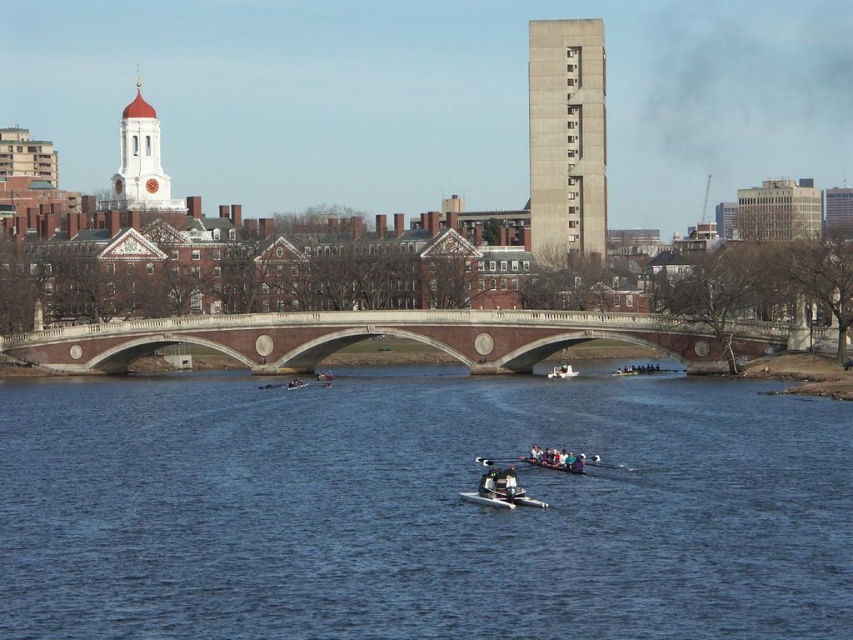
Question: Which object is the farthest from the white plastic boat at center?

Choices:
 (A) matte black rowboat at center
 (B) blue water at center
 (C) white glossy rowboat at center
 (D) matte brick clock tower at upper left

Answer: (D)

Question: Which of the following is the closest to the observer?

Choices:
 (A) (296, 381)
 (B) (160, 164)
 (C) (489, 460)
 (D) (207, 380)

Answer: (C)

Question: Which point is closer to the camera?

Choices:
 (A) (556, 378)
 (B) (380, 333)
 (C) (755, 417)
 (D) (582, 243)

Answer: (C)

Question: Can you confirm if matte brick clock tower at upper left is bigger than matte black rowboat at center?

Choices:
 (A) no
 (B) yes

Answer: (B)

Question: Is white glossy rowboat at center further to camera compared to matte black rowboat at center?

Choices:
 (A) no
 (B) yes

Answer: (A)

Question: Can you confirm if concrete block building at upper center is bigger than white plastic kayak at center?

Choices:
 (A) no
 (B) yes

Answer: (B)